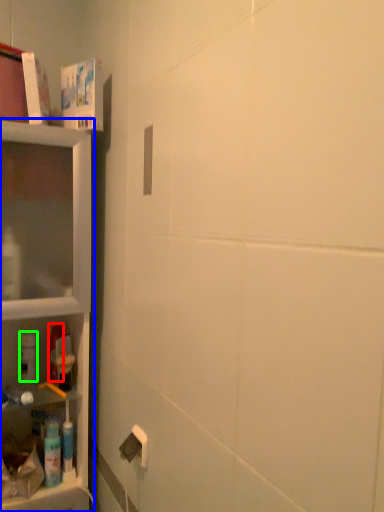
Question: Estimate the real-world distances between objects in this image. Which object is farther from mouthwash (highlighted by a red box), shelf (highlighted by a blue box) or cleaning product (highlighted by a green box)?

Choices:
 (A) shelf
 (B) cleaning product

Answer: (A)